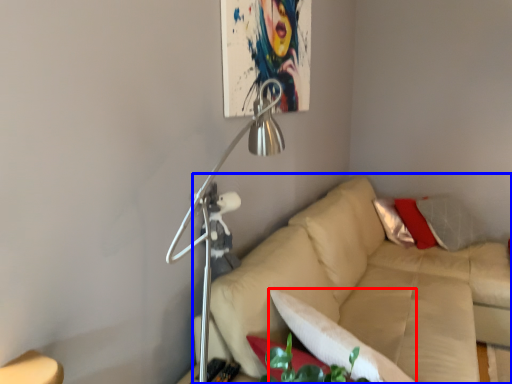
Question: Which of the following is the closest to the observer, pillow (highlighted by a red box) or studio couch (highlighted by a blue box)?

Choices:
 (A) pillow
 (B) studio couch

Answer: (A)